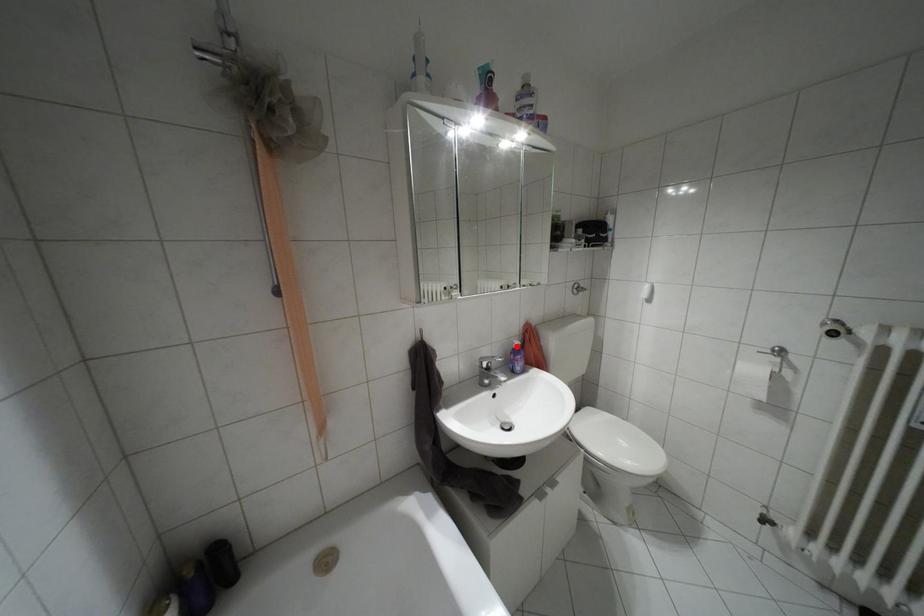
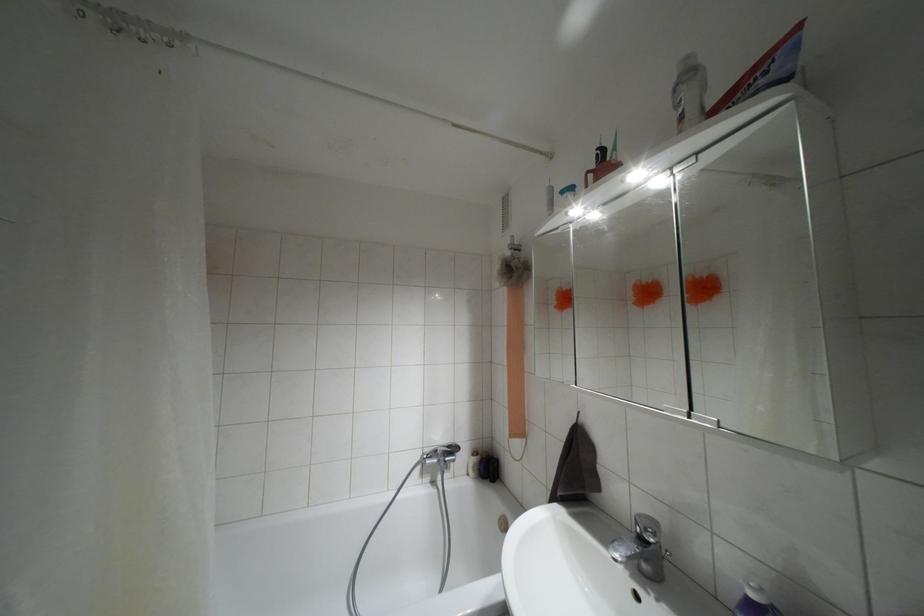
The point at the highlighted location is marked in the first image. Where is the corresponding point in the second image?

(751, 594)